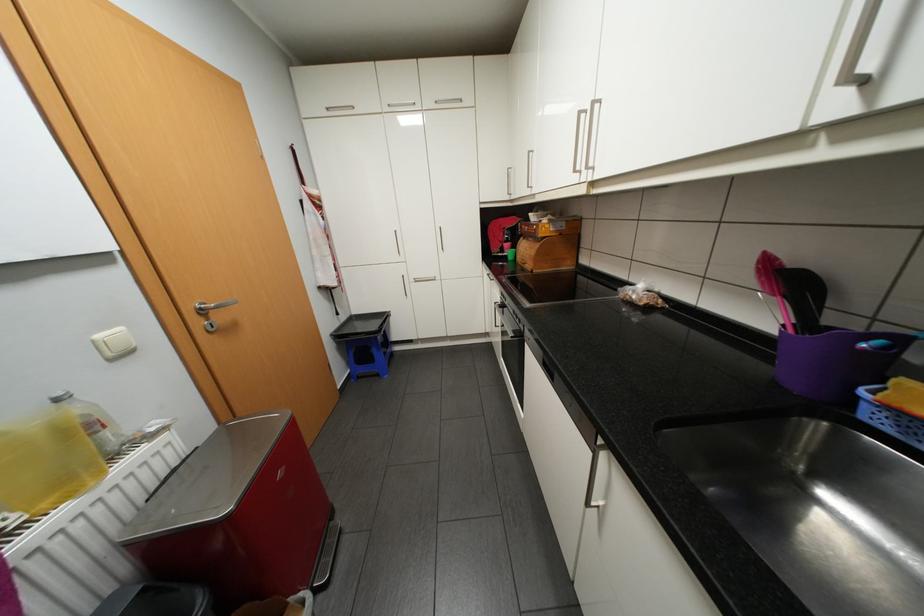
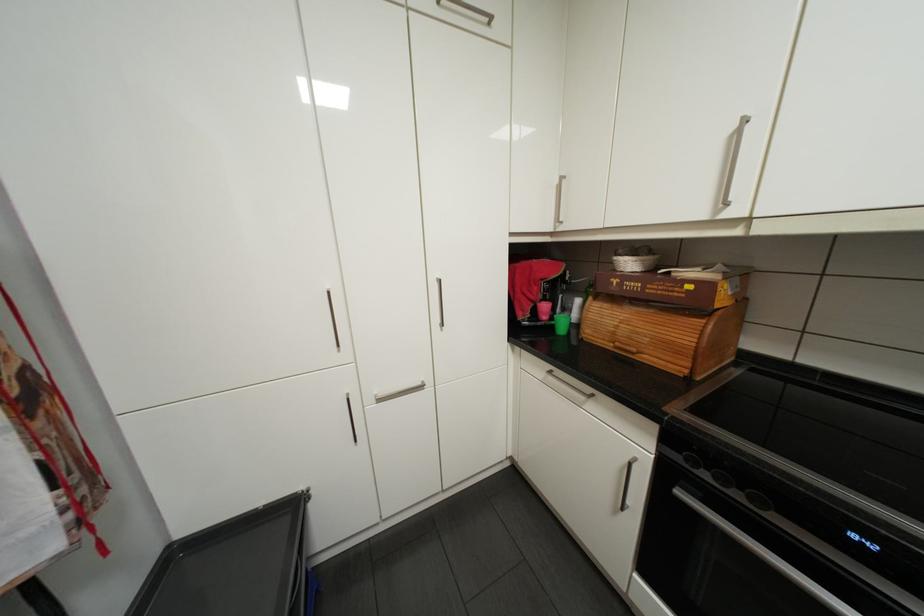
Where in the second image is the point corresponding to point 392,315 from the first image?

(300, 507)